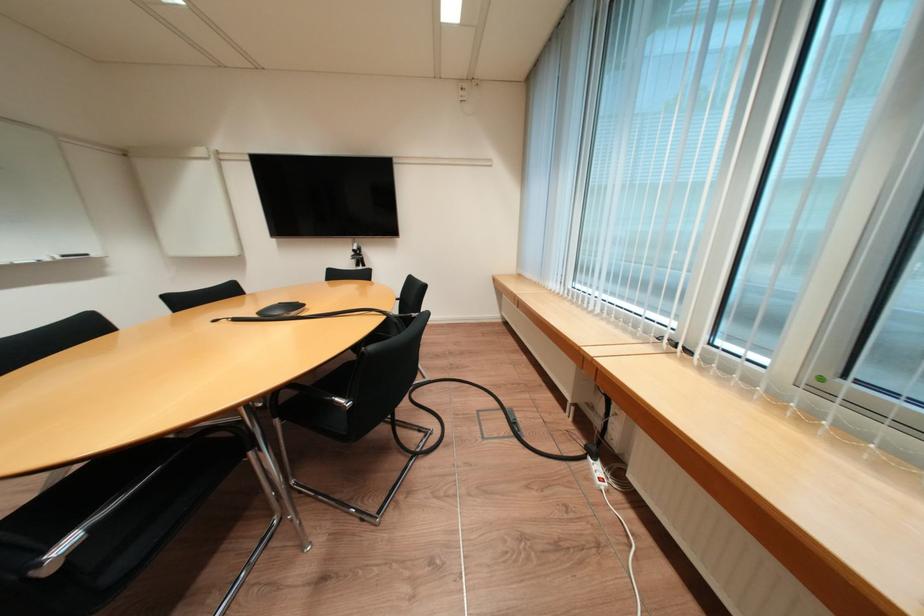
Locate an element on the screen. Image resolution: width=924 pixels, height=616 pixels. red power strip switch is located at coordinates (463, 92).